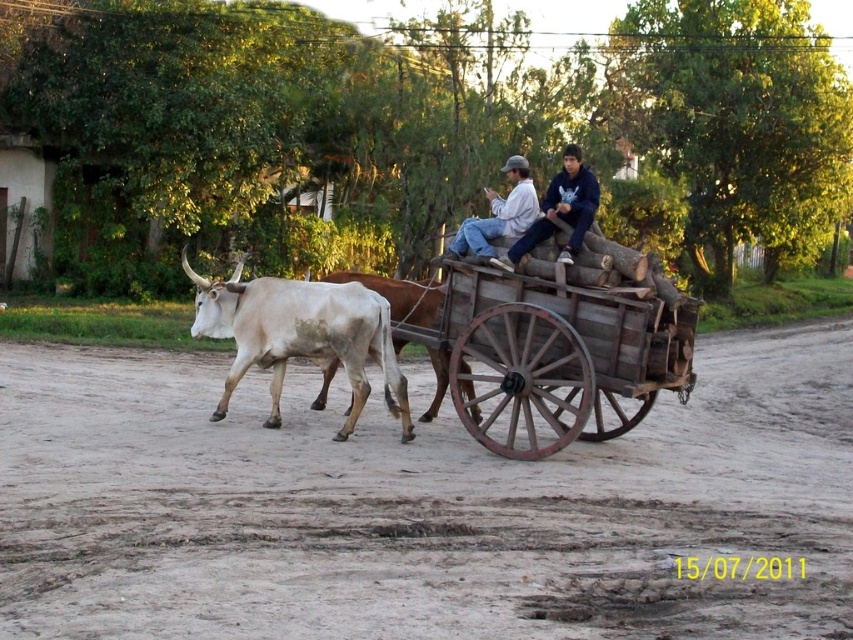
Between white smooth bull at center and white leather jacket at center, which one appears on the left side from the viewer's perspective?

From the viewer's perspective, white smooth bull at center appears more on the left side.

Can you confirm if white smooth bull at center is positioned below white leather jacket at center?

Correct, white smooth bull at center is located below white leather jacket at center.

What do you see at coordinates (300, 336) in the screenshot? Image resolution: width=853 pixels, height=640 pixels. I see `white smooth bull at center` at bounding box center [300, 336].

Where is `white smooth bull at center`? white smooth bull at center is located at coordinates (300, 336).

Does brown dirt field at center lie in front of white leather jacket at upper center?

Yes, brown dirt field at center is in front of white leather jacket at upper center.

Which is behind, point (776, 417) or point (519, 243)?

The point (776, 417) is behind.

Identify the location of brown dirt field at center. (418, 508).

Between brown dirt field at center and white smooth bull at center, which one is positioned higher?

Positioned higher is white smooth bull at center.

What do you see at coordinates (418, 508) in the screenshot?
I see `brown dirt field at center` at bounding box center [418, 508].

At what (x,y) coordinates should I click in order to perform the action: click on brown dirt field at center. Please return your answer as a coordinate pair (x, y). Looking at the image, I should click on (418, 508).